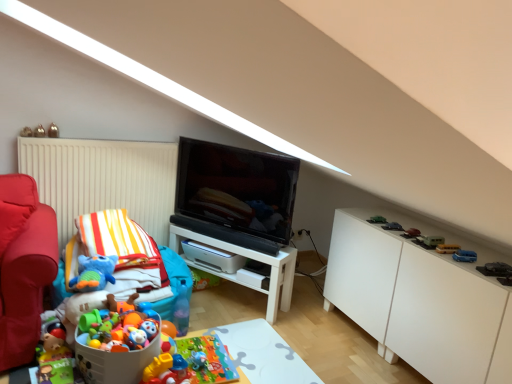
Locate an element on the screen. Image resolution: width=512 pixels, height=384 pixels. free space in front of metallic silver car at upper right, the 6th toy viewed from the right is located at coordinates (400, 231).